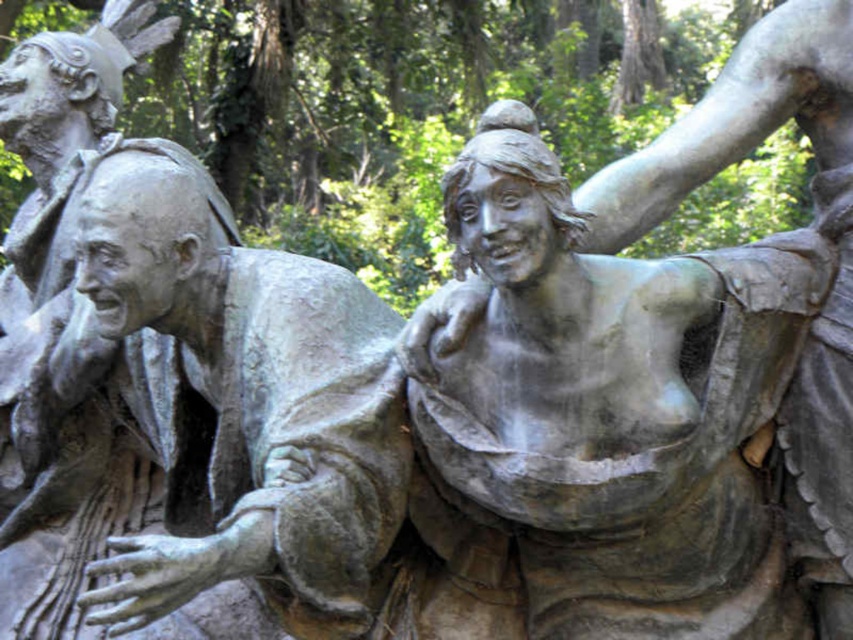
You are standing in front of the bronze sculpture and want to take a photo of the central figure. The camera you are using has a zoom lens that can focus on objects within a 0.7 meter radius. If you are positioned at point A, which is 0.5 meters away from the bronze statue at center, can you capture the entire central figure in your photo?

The bronze statue at center is located at point (660, 464). Since you are positioned at point A, 0.5 meters away from the bronze statue at center, and the camera can focus within a 0.7 meter radius, you are within range. Therefore, you can capture the entire central figure in your photo.

You are an art curator planning to rearrange the statues in the gallery. Currently, the bronze statue at center and the bronze statue at left are placed in a way that their positions might be confusing. Can you determine which bronze statue is located to the right when viewed from the front of the gallery?

The bronze statue at center is positioned on the right side of bronze statue at left, so the bronze statue at center is located to the right when viewed from the front of the gallery.